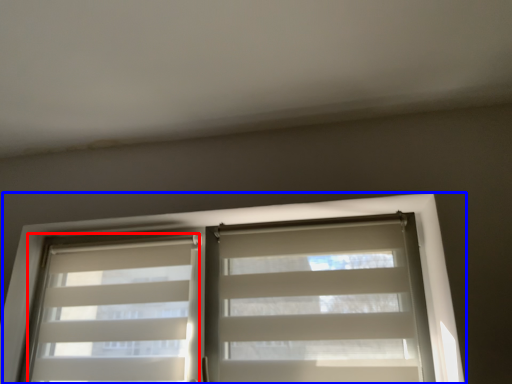
Question: Which object appears closest to the camera in this image, shutter (highlighted by a red box) or window (highlighted by a blue box)?

Choices:
 (A) shutter
 (B) window

Answer: (B)